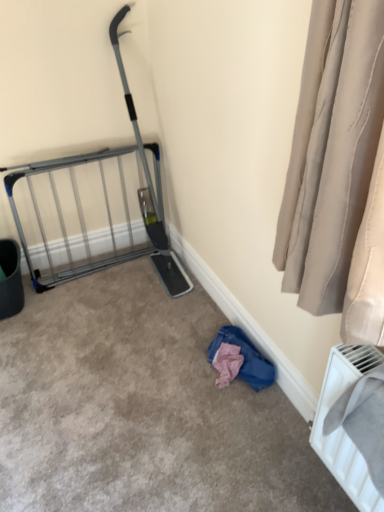
Question: Is white plastic radiator at lower right positioned with its back to silver metallic gate at left?

Choices:
 (A) yes
 (B) no

Answer: (B)

Question: Does white plastic radiator at lower right have a smaller size compared to silver metallic gate at left?

Choices:
 (A) yes
 (B) no

Answer: (A)

Question: Is white plastic radiator at lower right thinner than silver metallic gate at left?

Choices:
 (A) no
 (B) yes

Answer: (A)

Question: From a real-world perspective, is white plastic radiator at lower right physically below silver metallic gate at left?

Choices:
 (A) yes
 (B) no

Answer: (B)

Question: Is the position of white plastic radiator at lower right more distant than that of silver metallic gate at left?

Choices:
 (A) yes
 (B) no

Answer: (B)

Question: Is silver metallic gate at left to the left or to the right of pink fabric at lower right in the image?

Choices:
 (A) right
 (B) left

Answer: (B)

Question: Choose the correct answer: Is silver metallic gate at left inside pink fabric at lower right or outside it?

Choices:
 (A) outside
 (B) inside

Answer: (A)

Question: Is silver metallic gate at left in front of or behind pink fabric at lower right in the image?

Choices:
 (A) front
 (B) behind

Answer: (B)

Question: Is silver metallic gate at left taller or shorter than pink fabric at lower right?

Choices:
 (A) tall
 (B) short

Answer: (A)

Question: From a real-world perspective, is white plastic radiator at lower right positioned above or below pink fabric at lower right?

Choices:
 (A) below
 (B) above

Answer: (B)

Question: From the image's perspective, is white plastic radiator at lower right positioned above or below pink fabric at lower right?

Choices:
 (A) above
 (B) below

Answer: (B)

Question: Is white plastic radiator at lower right wider or thinner than pink fabric at lower right?

Choices:
 (A) thin
 (B) wide

Answer: (A)

Question: In the image, is white plastic radiator at lower right positioned in front of or behind pink fabric at lower right?

Choices:
 (A) front
 (B) behind

Answer: (A)

Question: Based on their sizes in the image, would you say silver metallic gate at left is bigger or smaller than white plastic radiator at lower right?

Choices:
 (A) big
 (B) small

Answer: (A)

Question: From the image's perspective, is silver metallic gate at left located above or below white plastic radiator at lower right?

Choices:
 (A) above
 (B) below

Answer: (A)